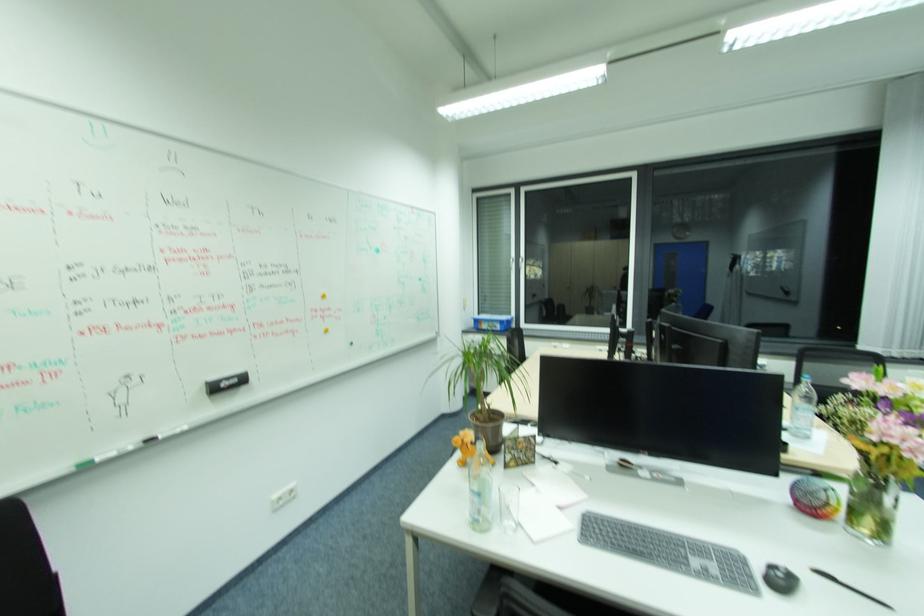
Where is `white window handle`? Image resolution: width=924 pixels, height=616 pixels. white window handle is located at coordinates (626, 277).